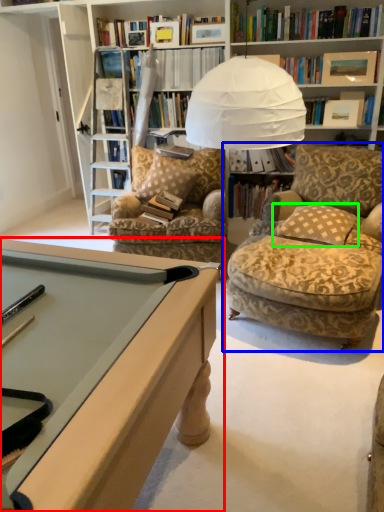
Question: Considering the real-world distances, which object is farthest from desk (highlighted by a red box)? chair (highlighted by a blue box) or pillow (highlighted by a green box)?

Choices:
 (A) chair
 (B) pillow

Answer: (B)